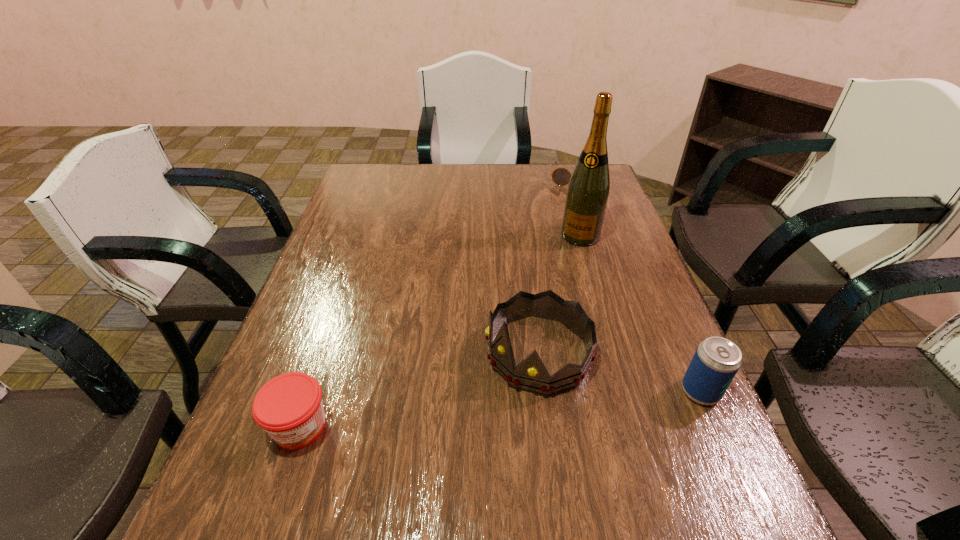
I want to click on vacant area at the far left corner, so click(362, 186).

At what (x,y) coordinates should I click in order to perform the action: click on unoccupied position between the leftmost object and the sunglasses. Please return your answer as a coordinate pair (x, y). The height and width of the screenshot is (540, 960). Looking at the image, I should click on (438, 302).

Where is `free space between the shortest object and the fourth tallest object`? free space between the shortest object and the fourth tallest object is located at coordinates (438, 302).

Where is `vacant space in between the beer can and the fourth shortest object`? vacant space in between the beer can and the fourth shortest object is located at coordinates (619, 372).

You are a GUI agent. You are given a task and a screenshot of the screen. Output one action in this format:
    pyautogui.click(x=<x>, y=<y>)
    Task: Click on the free spot between the beer can and the sunglasses
    The image size is (960, 540).
    Given the screenshot: What is the action you would take?
    pyautogui.click(x=637, y=285)

At what (x,y) coordinates should I click in order to perform the action: click on empty location between the fourth shortest object and the shortest object. Please return your answer as a coordinate pair (x, y). The height and width of the screenshot is (540, 960). Looking at the image, I should click on (557, 265).

Locate an element on the screen. free space between the tiara and the leftmost object is located at coordinates (420, 389).

Locate an element on the screen. The height and width of the screenshot is (540, 960). empty location between the farthest object and the beer can is located at coordinates (637, 285).

Locate an element on the screen. Image resolution: width=960 pixels, height=540 pixels. free spot between the beer can and the farthest object is located at coordinates (637, 285).

This screenshot has width=960, height=540. Find the location of `the third closest object to the beer can`. the third closest object to the beer can is located at coordinates (289, 407).